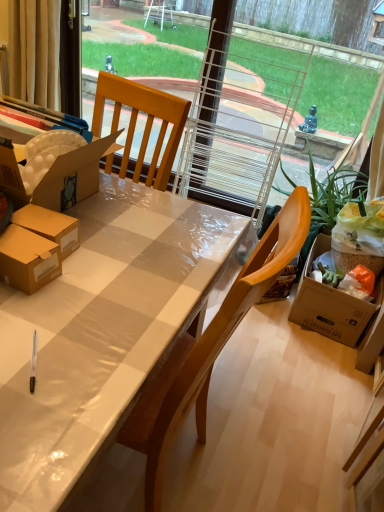
Question: From the image's perspective, is matte plastic desk at center positioned above or below green leafy plant at right?

Choices:
 (A) above
 (B) below

Answer: (B)

Question: From their relative heights in the image, would you say matte plastic desk at center is taller or shorter than green leafy plant at right?

Choices:
 (A) tall
 (B) short

Answer: (B)

Question: Which of these objects is positioned closest to the beige fabric curtain at upper left?

Choices:
 (A) matte plastic desk at center
 (B) green leafy plant at right

Answer: (B)

Question: Considering the real-world distances, which object is closest to the green leafy plant at right?

Choices:
 (A) beige fabric curtain at upper left
 (B) matte plastic desk at center

Answer: (B)